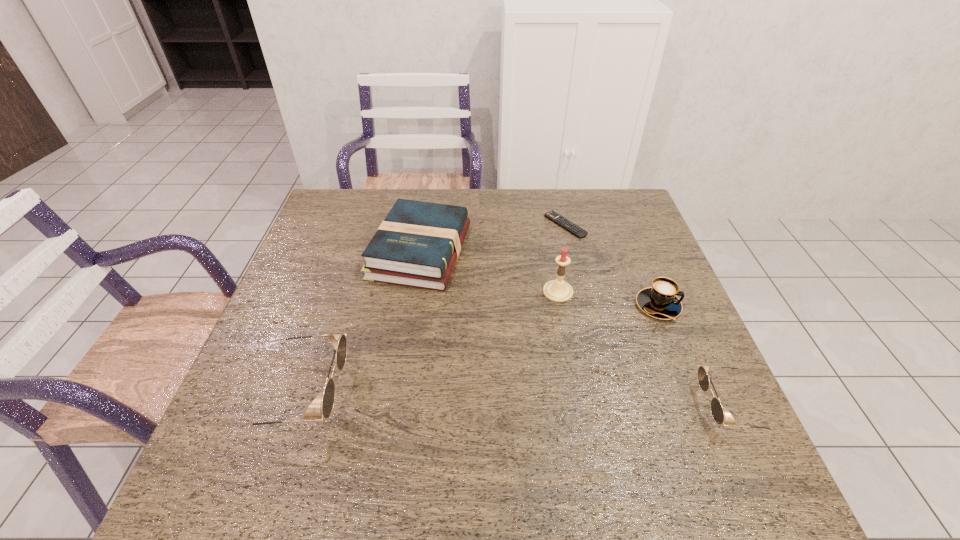
To make them evenly spaced by inserting another sunglasses among them, please locate a free space for this new sunglasses. Please provide its 2D coordinates. Your answer should be formatted as a tuple, i.e. [(x, y)], where the tuple contains the x and y coordinates of a point satisfying the conditions above.

[(513, 399)]